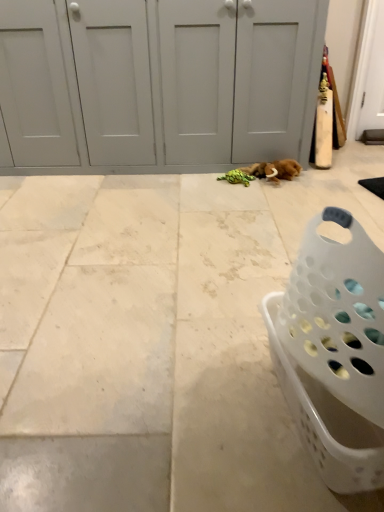
Measure the distance between white tile floor at center and camera.

white tile floor at center is 38.45 inches away from camera.

Image resolution: width=384 pixels, height=512 pixels. Describe the element at coordinates (326, 421) in the screenshot. I see `white plastic laundry basket at lower right` at that location.

Identify the location of white plastic laundry basket at lower right. This screenshot has width=384, height=512. coord(326,421).

Find the location of a particular element. Image resolution: width=384 pixels, height=512 pixels. white tile floor at center is located at coordinates (157, 339).

Could you tell me if white tile floor at center is turned towards white matte door at center?

Yes, white tile floor at center is oriented towards white matte door at center.

Is white tile floor at center thinner than white matte door at center?

No.

Which object is positioned more to the right, white tile floor at center or white matte door at center?

From the viewer's perspective, white tile floor at center appears more on the right side.

Is white plastic laundry basket at lower right at the back of white tile floor at center?

No.

Considering the relative sizes of white tile floor at center and white plastic laundry basket at lower right in the image provided, is white tile floor at center wider than white plastic laundry basket at lower right?

Correct, the width of white tile floor at center exceeds that of white plastic laundry basket at lower right.

Between white plastic laundry basket at lower right and white matte door at center, which one has smaller width?

Thinner between the two is white plastic laundry basket at lower right.

Does white plastic laundry basket at lower right have a greater height compared to white matte door at center?

No.

Is white plastic laundry basket at lower right located outside white matte door at center?

white plastic laundry basket at lower right lies outside white matte door at center's area.

Is white plastic laundry basket at lower right positioned in front of white matte door at center?

Yes, white plastic laundry basket at lower right is closer to the viewer.

At what (x,y) coordinates should I click in order to perform the action: click on door above the white plastic laundry basket at lower right (from the image's perspective). Please return your answer as a coordinate pair (x, y). This screenshot has width=384, height=512. Looking at the image, I should click on (156, 83).

Between white matte door at center and white plastic laundry basket at lower right, which one appears on the right side from the viewer's perspective?

white plastic laundry basket at lower right is more to the right.

Looking at the image, does white matte door at center seem bigger or smaller compared to white plastic laundry basket at lower right?

Considering their sizes, white matte door at center takes up more space than white plastic laundry basket at lower right.

You are a GUI agent. You are given a task and a screenshot of the screen. Output one action in this format:
    pyautogui.click(x=<x>, y=<y>)
    Task: Click on the door behind the white tile floor at center
    The width and height of the screenshot is (384, 512).
    Given the screenshot: What is the action you would take?
    pyautogui.click(x=156, y=83)

Considering the sizes of objects white matte door at center and white tile floor at center in the image provided, who is thinner, white matte door at center or white tile floor at center?

With smaller width is white matte door at center.

Between white matte door at center and white tile floor at center, which one appears on the left side from the viewer's perspective?

Positioned to the left is white matte door at center.

Is the depth of white plastic laundry basket at lower right less than that of white tile floor at center?

Yes, white plastic laundry basket at lower right is closer to the camera.

From a real-world perspective, is white plastic laundry basket at lower right beneath white tile floor at center?

Incorrect, from a real-world perspective, white plastic laundry basket at lower right is higher than white tile floor at center.

Which point is more forward, (279,382) or (174,307)?

The point (279,382) is in front.

Considering the relative sizes of white plastic laundry basket at lower right and white tile floor at center in the image provided, is white plastic laundry basket at lower right bigger than white tile floor at center?

Actually, white plastic laundry basket at lower right might be smaller than white tile floor at center.

Where is `concrete located in front of the white matte door at center`? The height and width of the screenshot is (512, 384). concrete located in front of the white matte door at center is located at coordinates (157, 339).

Where is `concrete below the white plastic laundry basket at lower right (from a real-world perspective)`? Image resolution: width=384 pixels, height=512 pixels. concrete below the white plastic laundry basket at lower right (from a real-world perspective) is located at coordinates pos(157,339).

Which object lies further to the anchor point white matte door at center, white plastic laundry basket at lower right or white tile floor at center?

white plastic laundry basket at lower right is positioned further to the anchor white matte door at center.

From the image, which object appears to be farther from white plastic laundry basket at lower right, white matte door at center or white tile floor at center?

white matte door at center is positioned further to the anchor white plastic laundry basket at lower right.

Which object lies nearer to the anchor point white plastic laundry basket at lower right, white tile floor at center or white matte door at center?

white tile floor at center is closer to white plastic laundry basket at lower right.

Estimate the real-world distances between objects in this image. Which object is further from white tile floor at center, white plastic laundry basket at lower right or white matte door at center?

white matte door at center is positioned further to the anchor white tile floor at center.

When comparing their distances from white tile floor at center, does white matte door at center or white plastic laundry basket at lower right seem further?

white matte door at center is further to white tile floor at center.

Estimate the real-world distances between objects in this image. Which object is further from white matte door at center, white tile floor at center or white plastic laundry basket at lower right?

Among the two, white plastic laundry basket at lower right is located further to white matte door at center.

Where is `concrete positioned between white plastic laundry basket at lower right and white matte door at center from near to far`? Image resolution: width=384 pixels, height=512 pixels. concrete positioned between white plastic laundry basket at lower right and white matte door at center from near to far is located at coordinates (157, 339).